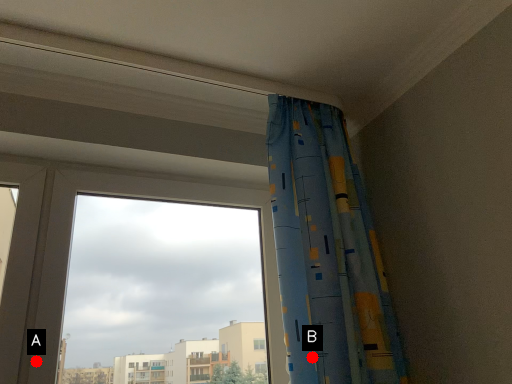
Question: Two points are circled on the image, labeled by A and B beside each circle. Which point is closer to the camera?

Choices:
 (A) A is closer
 (B) B is closer

Answer: (B)